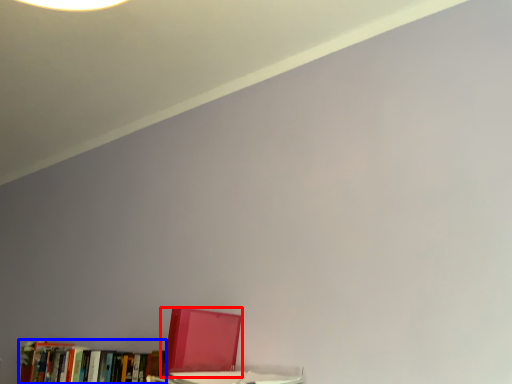
Question: Among these objects, which one is farthest to the camera, book (highlighted by a red box) or book (highlighted by a blue box)?

Choices:
 (A) book
 (B) book

Answer: (B)